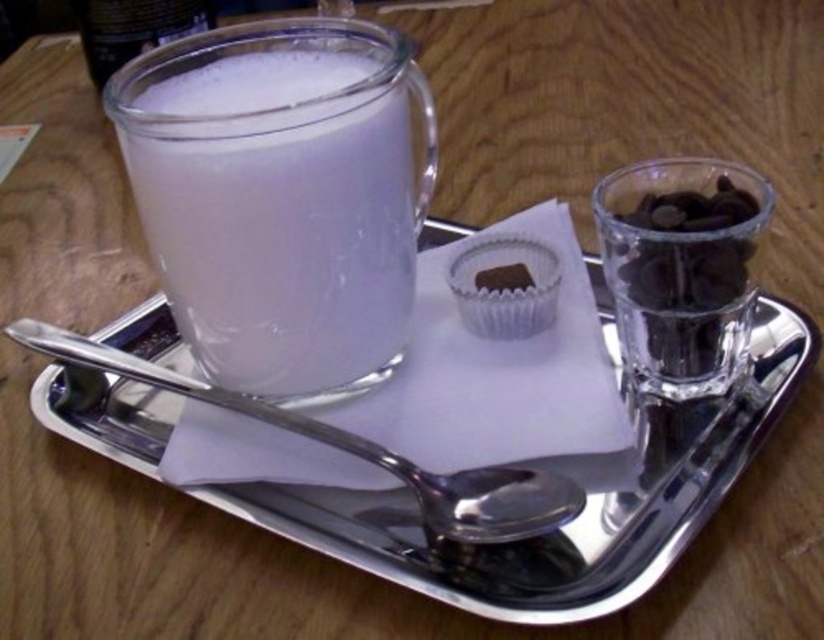
What is located at the point with coordinates (682, 268) on the image?

The point at coordinates (682, 268) is located on the black chocolate at upper right.

You are standing 1 meter away from the table. The point at coordinate (268,388) is part of an object on the tray. Can you reach that point with your hand without moving the tray?

The point at coordinate (268,388) is 32.63 centimeters away from the camera. Since you are standing 1 meter away from the table, which is 100 centimeters, the point is within your reach. You can extend your hand to touch it without moving the tray.

You are setting up a tea service and need to place the white frothy milk at upper left and the brushed metal spoon at lower center on the tray. Based on the arrangement, which item is positioned higher up on the tray?

The white frothy milk at upper left is positioned higher up on the tray compared to the brushed metal spoon at lower center, as it is located above it.